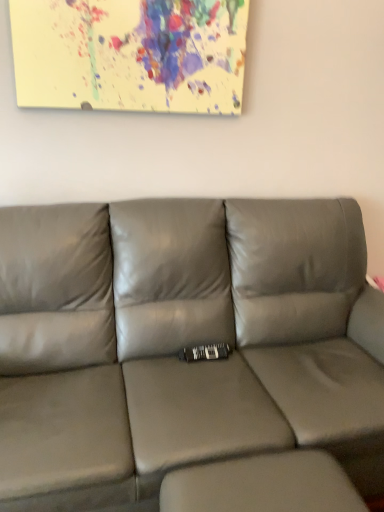
Where is `satin gray leather couch at center`? The image size is (384, 512). satin gray leather couch at center is located at coordinates (182, 343).

What is the approximate width of satin gray leather couch at center?

The width of satin gray leather couch at center is 97.74 centimeters.

What do you see at coordinates (182, 343) in the screenshot?
I see `satin gray leather couch at center` at bounding box center [182, 343].

Measure the distance between point [34,486] and camera.

They are 1.13 meters apart.

This screenshot has height=512, width=384. What do you see at coordinates (263, 485) in the screenshot? I see `gray leather footrest at lower right` at bounding box center [263, 485].

Measure the distance between gray leather footrest at lower right and camera.

The distance of gray leather footrest at lower right from camera is 3.52 feet.

In order to face gray leather footrest at lower right, should I rotate leftwards or rightwards?

Turn right by 8.841 degrees to look at gray leather footrest at lower right.

Where is `gray leather footrest at lower right`? gray leather footrest at lower right is located at coordinates (263, 485).

This screenshot has height=512, width=384. Identify the location of satin gray leather couch at center. (182, 343).

Considering the relative positions of gray leather footrest at lower right and satin gray leather couch at center in the image provided, is gray leather footrest at lower right to the right of satin gray leather couch at center from the viewer's perspective?

Indeed, gray leather footrest at lower right is positioned on the right side of satin gray leather couch at center.

Which object is more forward, gray leather footrest at lower right or satin gray leather couch at center?

satin gray leather couch at center is more forward.

Is point (209, 468) positioned behind point (278, 225)?

No, (209, 468) is closer to viewer.

From the image's perspective, between gray leather footrest at lower right and satin gray leather couch at center, which one is located above?

satin gray leather couch at center appears higher in the image.

From a real-world perspective, which is physically below, gray leather footrest at lower right or satin gray leather couch at center?

gray leather footrest at lower right.

Is gray leather footrest at lower right thinner than satin gray leather couch at center?

Indeed, gray leather footrest at lower right has a lesser width compared to satin gray leather couch at center.

In terms of height, does gray leather footrest at lower right look taller or shorter compared to satin gray leather couch at center?

gray leather footrest at lower right is shorter than satin gray leather couch at center.

Considering the relative sizes of gray leather footrest at lower right and satin gray leather couch at center in the image provided, is gray leather footrest at lower right smaller than satin gray leather couch at center?

Yes, gray leather footrest at lower right is smaller than satin gray leather couch at center.

Is satin gray leather couch at center a part of gray leather footrest at lower right?

Definitely not — satin gray leather couch at center is not inside gray leather footrest at lower right.

Is gray leather footrest at lower right positioned far away from satin gray leather couch at center?

Actually, gray leather footrest at lower right and satin gray leather couch at center are a little close together.

Is gray leather footrest at lower right positioned with its back to satin gray leather couch at center?

Yes, satin gray leather couch at center is at the back of gray leather footrest at lower right.

What's the angular difference between gray leather footrest at lower right and satin gray leather couch at center's facing directions?

3.13 degrees separate the facing orientations of gray leather footrest at lower right and satin gray leather couch at center.

Where is `studio couch in front of the gray leather footrest at lower right`? This screenshot has height=512, width=384. studio couch in front of the gray leather footrest at lower right is located at coordinates [182, 343].

Does satin gray leather couch at center appear on the left side of gray leather footrest at lower right?

Yes, satin gray leather couch at center is to the left of gray leather footrest at lower right.

In the image, is satin gray leather couch at center positioned in front of or behind gray leather footrest at lower right?

satin gray leather couch at center is positioned closer to the viewer than gray leather footrest at lower right.

Between point (87, 360) and point (260, 472), which one is positioned behind?

The point (87, 360) is farther.

From the image's perspective, which is above, satin gray leather couch at center or gray leather footrest at lower right?

satin gray leather couch at center.

From a real-world perspective, between satin gray leather couch at center and gray leather footrest at lower right, who is vertically lower?

gray leather footrest at lower right.

Considering the sizes of satin gray leather couch at center and gray leather footrest at lower right in the image, is satin gray leather couch at center wider or thinner than gray leather footrest at lower right?

satin gray leather couch at center is wider than gray leather footrest at lower right.

Considering the sizes of objects satin gray leather couch at center and gray leather footrest at lower right in the image provided, who is taller, satin gray leather couch at center or gray leather footrest at lower right?

Standing taller between the two is satin gray leather couch at center.

Consider the image. Considering the sizes of satin gray leather couch at center and gray leather footrest at lower right in the image, is satin gray leather couch at center bigger or smaller than gray leather footrest at lower right?

In the image, satin gray leather couch at center appears to be larger than gray leather footrest at lower right.

Would you say satin gray leather couch at center is inside or outside gray leather footrest at lower right?

satin gray leather couch at center is spatially situated outside gray leather footrest at lower right.

Is satin gray leather couch at center not close to gray leather footrest at lower right?

No, satin gray leather couch at center is not far from gray leather footrest at lower right.

Is satin gray leather couch at center aimed at gray leather footrest at lower right?

Yes, satin gray leather couch at center faces towards gray leather footrest at lower right.

How many degrees apart are the facing directions of satin gray leather couch at center and gray leather footrest at lower right?

The angle between the facing direction of satin gray leather couch at center and the facing direction of gray leather footrest at lower right is 3.13 degrees.

Where is `the footrest behind the satin gray leather couch at center`? This screenshot has width=384, height=512. the footrest behind the satin gray leather couch at center is located at coordinates (263, 485).

The image size is (384, 512). What are the coordinates of `studio couch above the gray leather footrest at lower right (from the image's perspective)` in the screenshot? It's located at (182, 343).

Find the location of a particular element. studio couch that appears above the gray leather footrest at lower right (from a real-world perspective) is located at coordinates (182, 343).